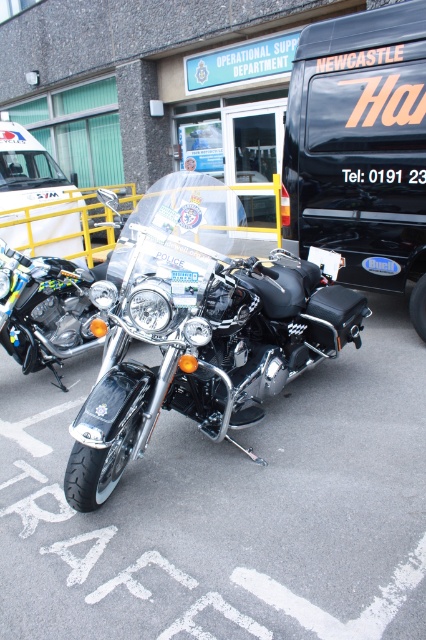
You are a delivery person who needs to park a vehicle that is 4 meters long. You see the black matte van at center in the parking lot. Can you safely park your vehicle next to it without any overhang?

The black matte van at center is 4.34 meters from the camera, but this distance does not indicate its length. Therefore, it is unclear if your 4 meter vehicle can park safely next to it without overhang.

Based on the photo, you are a photographer planning to take a photo of the shiny chrome motorcycle at center. You want to ensure it fills the frame without cropping any part of it. Given that the black matte van at center is blocking part of the motorcycle, can you determine if moving closer to the motorcycle would help achieve this?

The black matte van at center is larger in size than shiny chrome motorcycle at center. Moving closer to the motorcycle would reduce the van obstruction, but since the van is larger, it might still block part of the motorcycle unless you move far enough to make the van smaller in the frame.

You are a delivery person trying to park your van near the police station. The parking spot you want is directly behind the polished chrome motorcycle at center. According to the coordinates provided, can you estimate if there is enough space between the motorcycle and the building to park your van?

The polished chrome motorcycle at center is located at point [198,336]. However, without knowing the dimensions of the parking spot or the van, it is impossible to determine if there is sufficient space to park behind the motorcycle. Additional information about the van size and parking area is needed to make an accurate assessment.